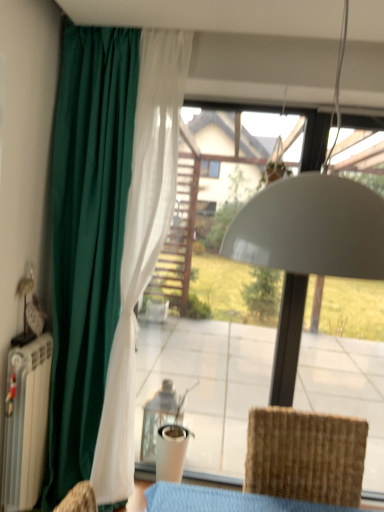
Question: Is woven brown chair at lower right directly adjacent to green fabric curtain at left?

Choices:
 (A) no
 (B) yes

Answer: (A)

Question: Is woven brown chair at lower right taller than green fabric curtain at left?

Choices:
 (A) no
 (B) yes

Answer: (A)

Question: Considering the relative sizes of woven brown chair at lower right and green fabric curtain at left in the image provided, is woven brown chair at lower right wider than green fabric curtain at left?

Choices:
 (A) no
 (B) yes

Answer: (B)

Question: Can green fabric curtain at left be found inside woven brown chair at lower right?

Choices:
 (A) yes
 (B) no

Answer: (B)

Question: Considering the relative positions of woven brown chair at lower right and green fabric curtain at left in the image provided, is woven brown chair at lower right behind green fabric curtain at left?

Choices:
 (A) no
 (B) yes

Answer: (A)

Question: Is woven brown chair at lower right outside green fabric curtain at left?

Choices:
 (A) yes
 (B) no

Answer: (A)

Question: Considering the relative sizes of green fabric curtain at left and woven brown chair at lower right in the image provided, is green fabric curtain at left smaller than woven brown chair at lower right?

Choices:
 (A) no
 (B) yes

Answer: (A)

Question: From the image's perspective, would you say green fabric curtain at left is shown under woven brown chair at lower right?

Choices:
 (A) no
 (B) yes

Answer: (A)

Question: Is woven brown chair at lower right surrounded by green fabric curtain at left?

Choices:
 (A) yes
 (B) no

Answer: (B)

Question: Is green fabric curtain at left facing away from woven brown chair at lower right?

Choices:
 (A) no
 (B) yes

Answer: (A)

Question: Is green fabric curtain at left to the left of woven brown chair at lower right from the viewer's perspective?

Choices:
 (A) no
 (B) yes

Answer: (B)

Question: Is there a large distance between green fabric curtain at left and woven brown chair at lower right?

Choices:
 (A) yes
 (B) no

Answer: (A)

Question: Considering their positions, is green fabric curtain at left located in front of or behind woven brown chair at lower right?

Choices:
 (A) front
 (B) behind

Answer: (B)